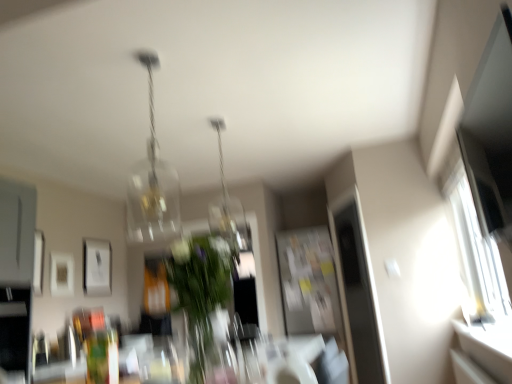
Question: Does translucent glass chandelier at upper center, positioned as the 2th lamp in right-to-left order, have a lesser height compared to clear glass pendant light at center, positioned as the 1th lamp in back-to-front order?

Choices:
 (A) yes
 (B) no

Answer: (A)

Question: Is translucent glass chandelier at upper center, positioned as the 2th lamp in right-to-left order, at the left side of clear glass pendant light at center, positioned as the 1th lamp in back-to-front order?

Choices:
 (A) yes
 (B) no

Answer: (A)

Question: Is translucent glass chandelier at upper center, which ranks as the 1th lamp in left-to-right order, taller than clear glass pendant light at center, positioned as the 1th lamp in back-to-front order?

Choices:
 (A) no
 (B) yes

Answer: (A)

Question: From a real-world perspective, is translucent glass chandelier at upper center, positioned as the first lamp in front-to-back order, physically above clear glass pendant light at center, placed as the first lamp when sorted from right to left?

Choices:
 (A) yes
 (B) no

Answer: (A)

Question: From a real-world perspective, is translucent glass chandelier at upper center, positioned as the first lamp in front-to-back order, located beneath clear glass pendant light at center, which is the second lamp in front-to-back order?

Choices:
 (A) no
 (B) yes

Answer: (A)

Question: Considering the positions of transparent glass vase at center and translucent glass chandelier at upper center, positioned as the first lamp in front-to-back order, in the image, is transparent glass vase at center taller or shorter than translucent glass chandelier at upper center, positioned as the first lamp in front-to-back order,?

Choices:
 (A) short
 (B) tall

Answer: (A)

Question: From a real-world perspective, is transparent glass vase at center above or below translucent glass chandelier at upper center, which appears as the 2th lamp when viewed from the back?

Choices:
 (A) below
 (B) above

Answer: (A)

Question: Considering the positions of transparent glass vase at center and translucent glass chandelier at upper center, which appears as the 2th lamp when viewed from the back, in the image, is transparent glass vase at center wider or thinner than translucent glass chandelier at upper center, which appears as the 2th lamp when viewed from the back,?

Choices:
 (A) thin
 (B) wide

Answer: (A)

Question: Is transparent glass vase at center spatially inside translucent glass chandelier at upper center, positioned as the 2th lamp in right-to-left order, or outside of it?

Choices:
 (A) inside
 (B) outside

Answer: (B)

Question: Does point [206, 372] appear closer or farther from the camera than point [60, 261]?

Choices:
 (A) farther
 (B) closer

Answer: (A)

Question: Visually, is transparent glass vase at center positioned to the left or to the right of white matte picture frame at left, placed as the 2th picture frame when sorted from left to right?

Choices:
 (A) right
 (B) left

Answer: (A)

Question: In terms of size, does transparent glass vase at center appear bigger or smaller than white matte picture frame at left, placed as the 2th picture frame when sorted from left to right?

Choices:
 (A) big
 (B) small

Answer: (B)

Question: From the image's perspective, relative to white matte picture frame at left, arranged as the 2th picture frame when viewed from the front, is transparent glass vase at center above or below?

Choices:
 (A) above
 (B) below

Answer: (A)

Question: Considering the relative positions of transparent glass vase at center and matte white picture frame at left, positioned as the third picture frame in back-to-front order, in the image provided, is transparent glass vase at center to the left or to the right of matte white picture frame at left, positioned as the third picture frame in back-to-front order,?

Choices:
 (A) left
 (B) right

Answer: (B)

Question: Considering their positions, is transparent glass vase at center located in front of or behind matte white picture frame at left, the third picture frame when ordered from right to left?

Choices:
 (A) behind
 (B) front

Answer: (B)